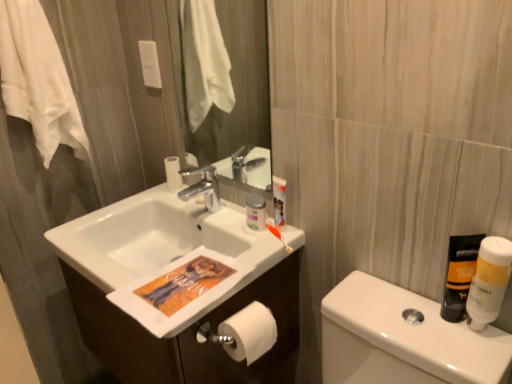
Find the location of a particular element. Image resolution: width=512 pixels, height=384 pixels. vacant area situated to the left side of translucent plastic bottle at right, the first mouthwash when ordered from left to right is located at coordinates (390, 310).